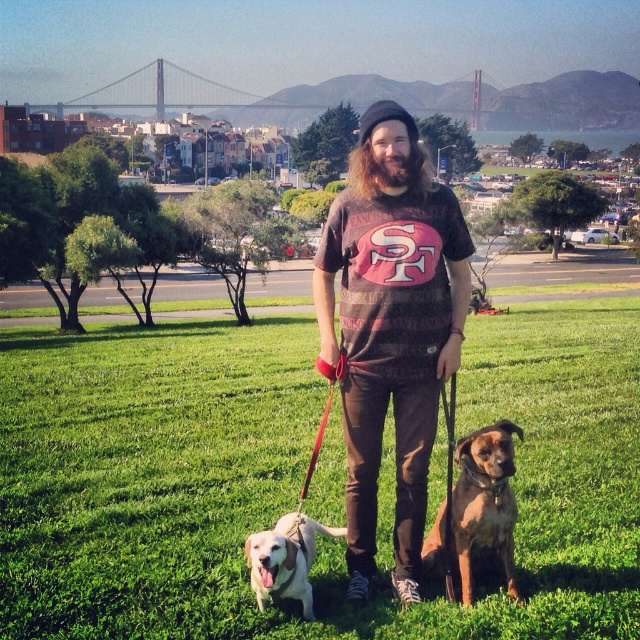
Question: Does green grass at center have a larger size compared to brown leather dog at lower right?

Choices:
 (A) yes
 (B) no

Answer: (A)

Question: Can you confirm if green grass at center is positioned above brown leather dog at lower right?

Choices:
 (A) no
 (B) yes

Answer: (B)

Question: Which object is closer to the camera taking this photo?

Choices:
 (A) brown leather dog at lower right
 (B) white fur dog at lower left

Answer: (B)

Question: Does brown cotton t-shirt at center lie behind metallic bridge at upper center?

Choices:
 (A) yes
 (B) no

Answer: (B)

Question: Which is nearer to the brown leather dog at lower right?

Choices:
 (A) brown cotton t-shirt at center
 (B) white fur dog at lower left
 (C) metallic bridge at upper center

Answer: (A)

Question: Among these points, which one is farthest from the camera?

Choices:
 (A) (93, 381)
 (B) (339, 83)

Answer: (B)